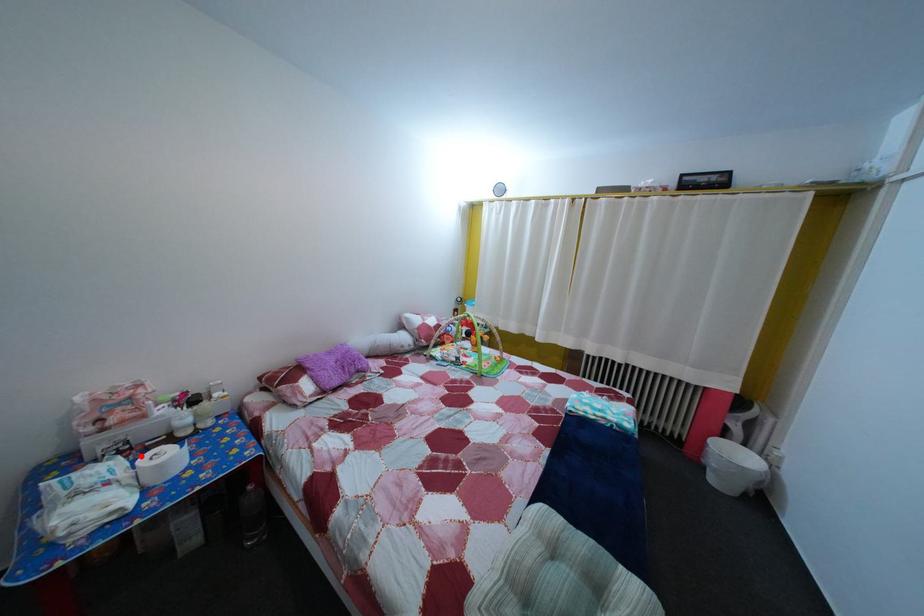
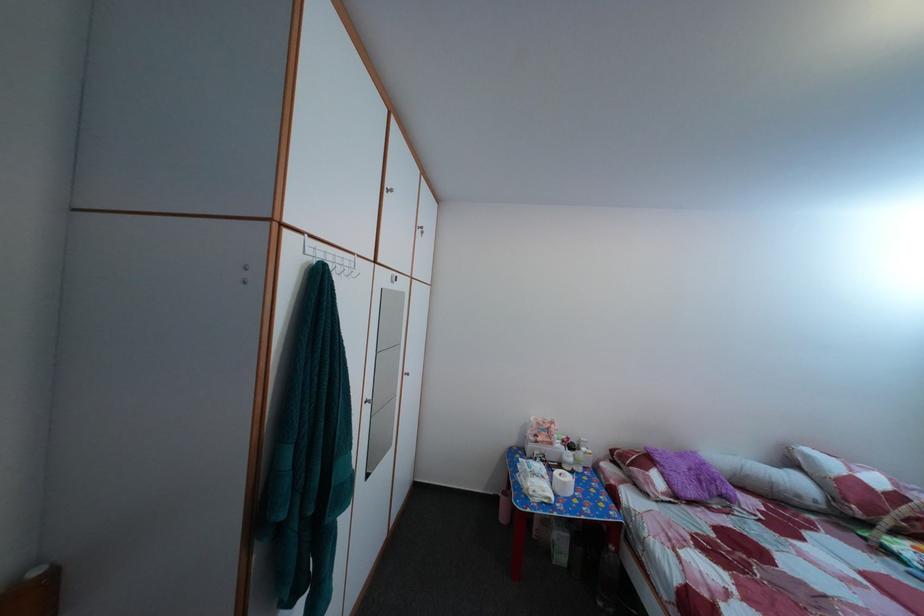
Find the pixel in the second image that matches the highlighted location in the first image.

(555, 469)